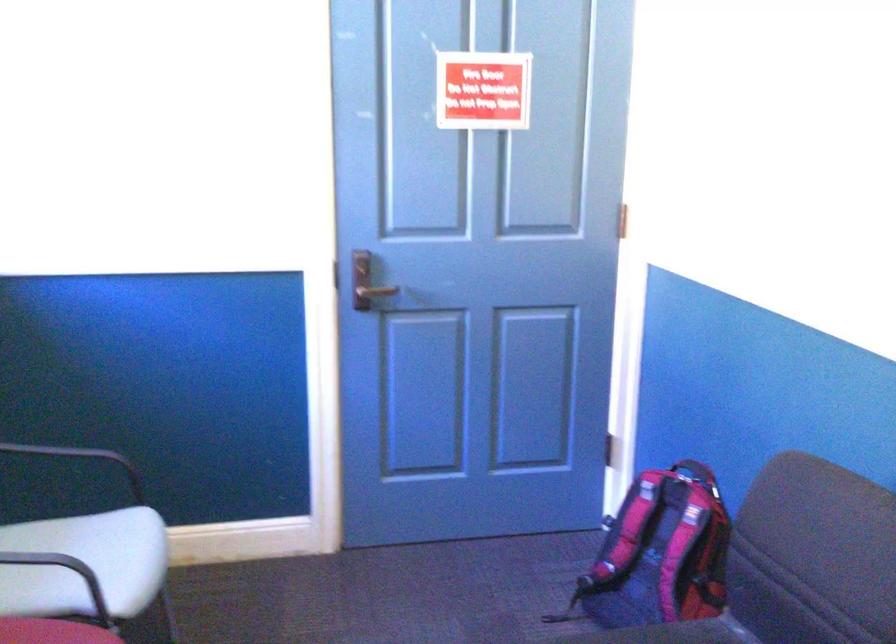
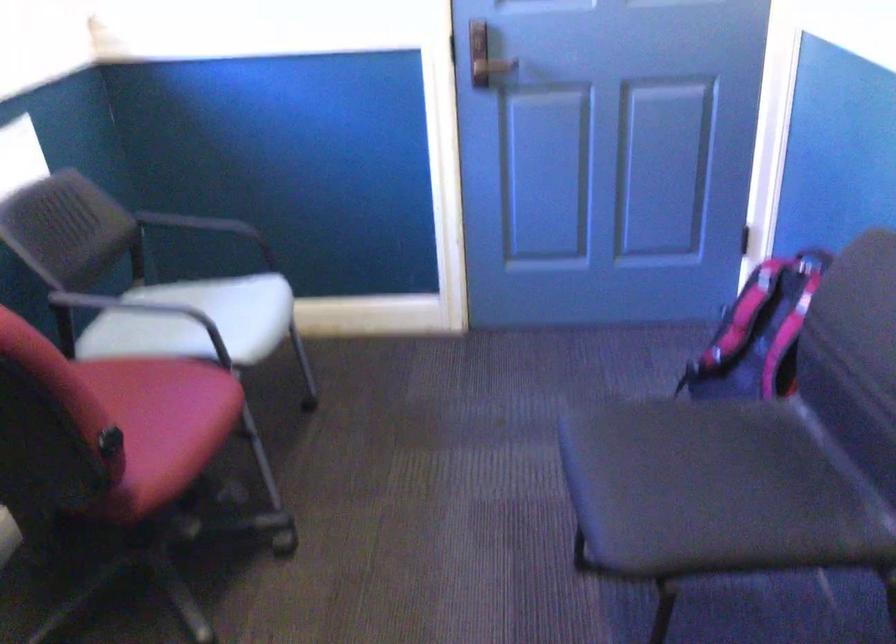
The point at (x=375, y=287) is marked in the first image. Where is the corresponding point in the second image?

(492, 67)